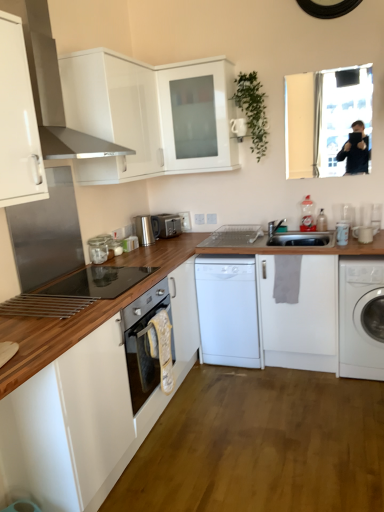
The image size is (384, 512). Identify the location of vacant area that is in front of satin silver toaster at center, placed as the 1th kitchen appliance when sorted from top to bottom. (139, 249).